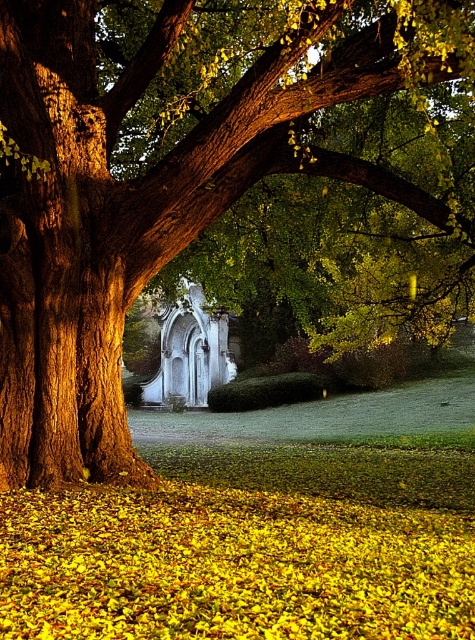
Is yellow leaf litter at ground bigger than white stone chapel at center?

Yes.

Is yellow leaf litter at ground smaller than white stone chapel at center?

Incorrect, yellow leaf litter at ground is not smaller in size than white stone chapel at center.

Between point (17, 602) and point (202, 378), which one is positioned in front?

Point (17, 602) is in front.

You are a GUI agent. You are given a task and a screenshot of the screen. Output one action in this format:
    pyautogui.click(x=<x>, y=<y>)
    Task: Click on the yellow leaf litter at ground
    This screenshot has height=640, width=475.
    Given the screenshot: What is the action you would take?
    pyautogui.click(x=229, y=566)